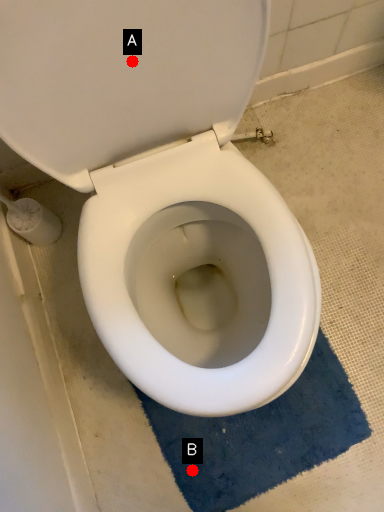
Question: Two points are circled on the image, labeled by A and B beside each circle. Among these points, which one is nearest to the camera?

Choices:
 (A) A is closer
 (B) B is closer

Answer: (A)